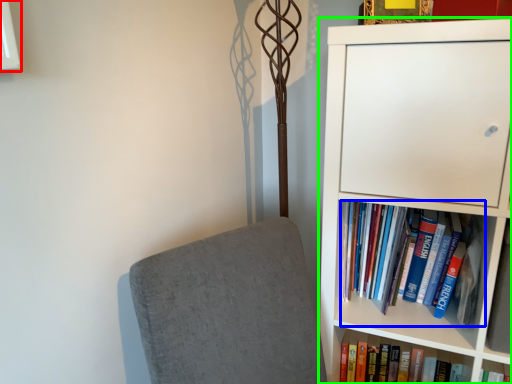
Question: Based on their relative distances, which object is farther from window (highlighted by a red box)? Choose from book (highlighted by a blue box) and bookcase (highlighted by a green box).

Choices:
 (A) book
 (B) bookcase

Answer: (A)